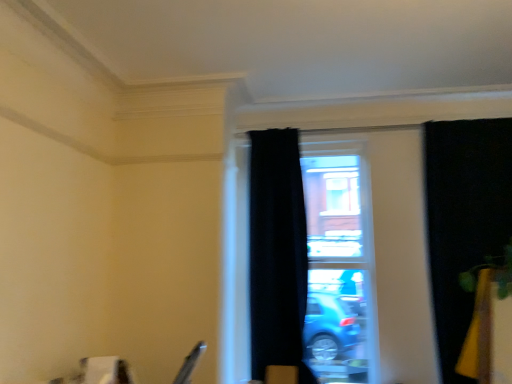
Question: In terms of size, does black velvet curtain at center, which is the 2th curtain in right-to-left order, appear bigger or smaller than transparent glass window at center?

Choices:
 (A) big
 (B) small

Answer: (B)

Question: From a real-world perspective, is black velvet curtain at center, which is the 2th curtain in right-to-left order, above or below transparent glass window at center?

Choices:
 (A) below
 (B) above

Answer: (B)

Question: Which of these objects is positioned closest to the black velvet curtain at right, which is the 1th curtain in right-to-left order?

Choices:
 (A) transparent glass window at center
 (B) black velvet curtain at center, which is the 2th curtain in right-to-left order

Answer: (A)

Question: Which of these objects is positioned farthest from the black velvet curtain at right, which is the 2th curtain in left-to-right order?

Choices:
 (A) black velvet curtain at center, which is the 2th curtain in right-to-left order
 (B) transparent glass window at center

Answer: (A)